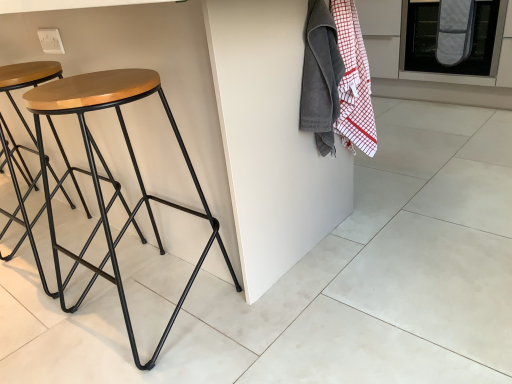
The width and height of the screenshot is (512, 384). What do you see at coordinates (454, 74) in the screenshot?
I see `gray quilted oven mitt at upper right` at bounding box center [454, 74].

Image resolution: width=512 pixels, height=384 pixels. What are the coordinates of `white matte tile at lower right` in the screenshot? It's located at (437, 285).

Locate an element on the screen. This screenshot has width=512, height=384. gray quilted oven mitt at upper right is located at coordinates (454, 74).

Consider the image. Can you confirm if white matte tile at lower right is smaller than woodenmaterial/texturestool at left?

Yes, white matte tile at lower right is smaller than woodenmaterial/texturestool at left.

Is white matte tile at lower right closer to the viewer compared to woodenmaterial/texturestool at left?

No, white matte tile at lower right is behind woodenmaterial/texturestool at left.

Image resolution: width=512 pixels, height=384 pixels. Identify the location of tile behind the woodenmaterial/texturestool at left. (437, 285).

Is white matte tile at lower right facing away from woodenmaterial/texturestool at left?

That's not correct — white matte tile at lower right is not looking away from woodenmaterial/texturestool at left.

Which is in front, point (502, 6) or point (70, 80)?

Point (70, 80)

Between gray quilted oven mitt at upper right and woodenmaterial/texturestool at left, which one appears on the left side from the viewer's perspective?

A: Positioned to the left is woodenmaterial/texturestool at left.

Is gray quilted oven mitt at upper right further to camera compared to woodenmaterial/texturestool at left?

Yes.

How many degrees apart are the facing directions of white matte tile at lower right and gray quilted oven mitt at upper right?

They differ by 90.1 degrees in their facing directions.

Would you consider white matte tile at lower right to be distant from gray quilted oven mitt at upper right?

white matte tile at lower right is far away from gray quilted oven mitt at upper right.

Can gray quilted oven mitt at upper right be found inside white matte tile at lower right?

No, white matte tile at lower right does not contain gray quilted oven mitt at upper right.

Which of these two, white matte tile at lower right or gray quilted oven mitt at upper right, is bigger?

gray quilted oven mitt at upper right is bigger.

From a real-world perspective, which is physically below, woodenmaterial/texturestool at left or velvet-like gray blanket at upper right?

woodenmaterial/texturestool at left.

Between woodenmaterial/texturestool at left and velvet-like gray blanket at upper right, which one has more height?

With more height is woodenmaterial/texturestool at left.

Is woodenmaterial/texturestool at left inside or outside of velvet-like gray blanket at upper right?

woodenmaterial/texturestool at left is located beyond the bounds of velvet-like gray blanket at upper right.

Are white matte tile at lower right and velvet-like gray blanket at upper right beside each other?

No, white matte tile at lower right is not in contact with velvet-like gray blanket at upper right.

Considering the sizes of objects white matte tile at lower right and velvet-like gray blanket at upper right in the image provided, who is taller, white matte tile at lower right or velvet-like gray blanket at upper right?

Standing taller between the two is velvet-like gray blanket at upper right.

From a real-world perspective, between white matte tile at lower right and velvet-like gray blanket at upper right, who is vertically higher?

velvet-like gray blanket at upper right, from a real-world perspective.

Could velvet-like gray blanket at upper right be considered to be inside white matte tile at lower right?

Actually, velvet-like gray blanket at upper right is outside white matte tile at lower right.

Is velvet-like gray blanket at upper right taller than gray quilted oven mitt at upper right?

Incorrect, the height of velvet-like gray blanket at upper right is not larger of that of gray quilted oven mitt at upper right.

Could you tell me if velvet-like gray blanket at upper right is facing gray quilted oven mitt at upper right?

Yes, velvet-like gray blanket at upper right faces towards gray quilted oven mitt at upper right.

From the picture: From a real-world perspective, who is located higher, velvet-like gray blanket at upper right or gray quilted oven mitt at upper right?

velvet-like gray blanket at upper right.

Does woodenmaterial/texturestool at left appear on the left side of white matte tile at lower right?

Indeed, woodenmaterial/texturestool at left is positioned on the left side of white matte tile at lower right.

Could you tell me if woodenmaterial/texturestool at left is turned towards white matte tile at lower right?

No.

Considering the positions of objects woodenmaterial/texturestool at left and white matte tile at lower right in the image provided, who is behind, woodenmaterial/texturestool at left or white matte tile at lower right?

Positioned behind is white matte tile at lower right.

Find the location of a particular element. tile located behind the woodenmaterial/texturestool at left is located at coordinates (437, 285).

Where is `stool on the left of the white matte tile at lower right`? stool on the left of the white matte tile at lower right is located at coordinates (112, 176).

This screenshot has height=384, width=512. In order to click on oven above the woodenmaterial/texturestool at left (from a real-world perspective) in this screenshot , I will do `click(454, 74)`.

Which object lies further to the anchor point woodenmaterial/texturestool at left, gray quilted oven mitt at upper right or white matte tile at lower right?

gray quilted oven mitt at upper right.

Looking at the image, which one is located closer to velvet-like gray blanket at upper right, gray quilted oven mitt at upper right or woodenmaterial/texturestool at left?

gray quilted oven mitt at upper right is positioned closer to the anchor velvet-like gray blanket at upper right.

In the scene shown: Estimate the real-world distances between objects in this image. Which object is closer to velvet-like gray blanket at upper right, woodenmaterial/texturestool at left or gray quilted oven mitt at upper right?

gray quilted oven mitt at upper right is positioned closer to the anchor velvet-like gray blanket at upper right.

Looking at this image, from the image, which object appears to be farther from velvet-like gray blanket at upper right, woodenmaterial/texturestool at left or white matte tile at lower right?

woodenmaterial/texturestool at left.

Considering their positions, is velvet-like gray blanket at upper right positioned closer to woodenmaterial/texturestool at left than gray quilted oven mitt at upper right?

velvet-like gray blanket at upper right is positioned closer to the anchor woodenmaterial/texturestool at left.

Looking at the image, which one is located further to velvet-like gray blanket at upper right, white matte tile at lower right or woodenmaterial/texturestool at left?

Based on the image, woodenmaterial/texturestool at left appears to be further to velvet-like gray blanket at upper right.

Estimate the real-world distances between objects in this image. Which object is further from gray quilted oven mitt at upper right, white matte tile at lower right or velvet-like gray blanket at upper right?

white matte tile at lower right.

Based on their spatial positions, is white matte tile at lower right or woodenmaterial/texturestool at left closer to gray quilted oven mitt at upper right?

The object closer to gray quilted oven mitt at upper right is white matte tile at lower right.

This screenshot has height=384, width=512. I want to click on oven between white matte tile at lower right and velvet-like gray blanket at upper right from front to back, so click(454, 74).

The width and height of the screenshot is (512, 384). I want to click on tile located between woodenmaterial/texturestool at left and gray quilted oven mitt at upper right in the left-right direction, so click(437, 285).

The image size is (512, 384). Identify the location of blanket between woodenmaterial/texturestool at left and gray quilted oven mitt at upper right in the horizontal direction. (454, 31).

In order to click on tile positioned between woodenmaterial/texturestool at left and velvet-like gray blanket at upper right from near to far in this screenshot , I will do `click(437, 285)`.